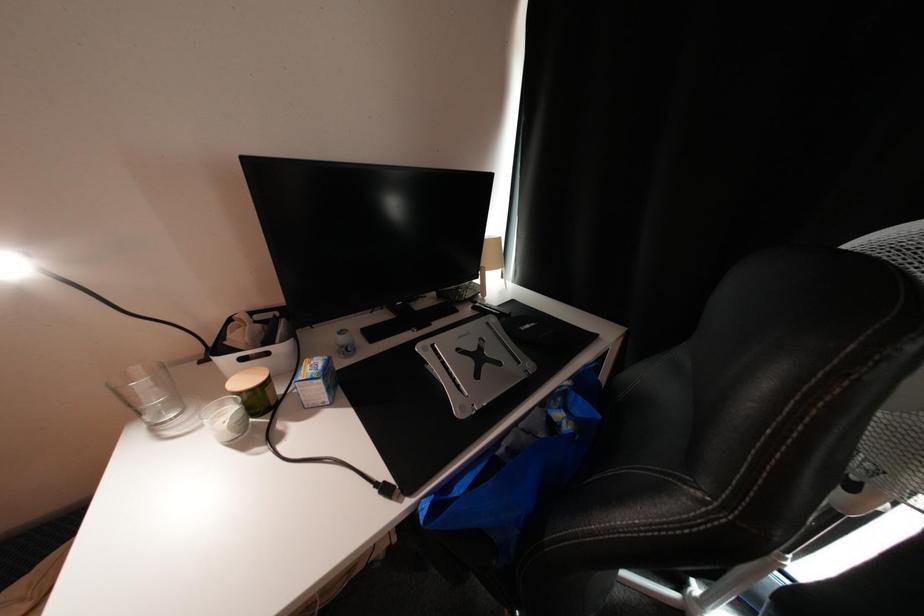
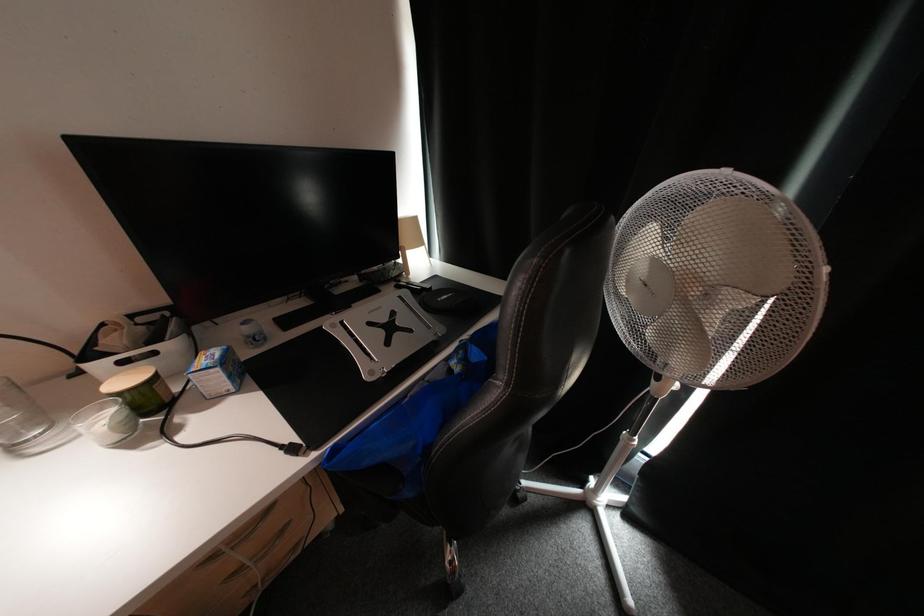
Question: How did the camera likely rotate?

Choices:
 (A) Left
 (B) Right
 (C) Up
 (D) Down

Answer: (B)